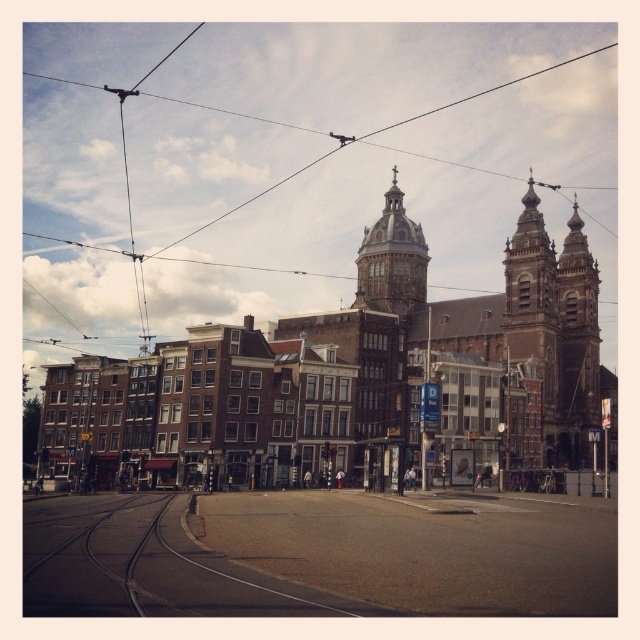
Does point (29, 292) lie in front of point (161, 547)?

No, (29, 292) is further to viewer.

Is metallic wire at upper center wider than dark gray asphalt train track at lower left?

Yes.

Locate an element on the screen. This screenshot has height=640, width=640. metallic wire at upper center is located at coordinates (364, 157).

Is dark gray asphalt train track at lower left above golden stone dome at center?

No.

Image resolution: width=640 pixels, height=640 pixels. What do you see at coordinates (113, 557) in the screenshot? I see `dark gray asphalt train track at lower left` at bounding box center [113, 557].

The width and height of the screenshot is (640, 640). I want to click on dark gray asphalt train track at lower left, so click(x=113, y=557).

Who is taller, metallic wire at upper center or brown stone church at center?

metallic wire at upper center is taller.

Does metallic wire at upper center have a larger size compared to brown stone church at center?

Yes.

Identify the location of metallic wire at upper center. (364, 157).